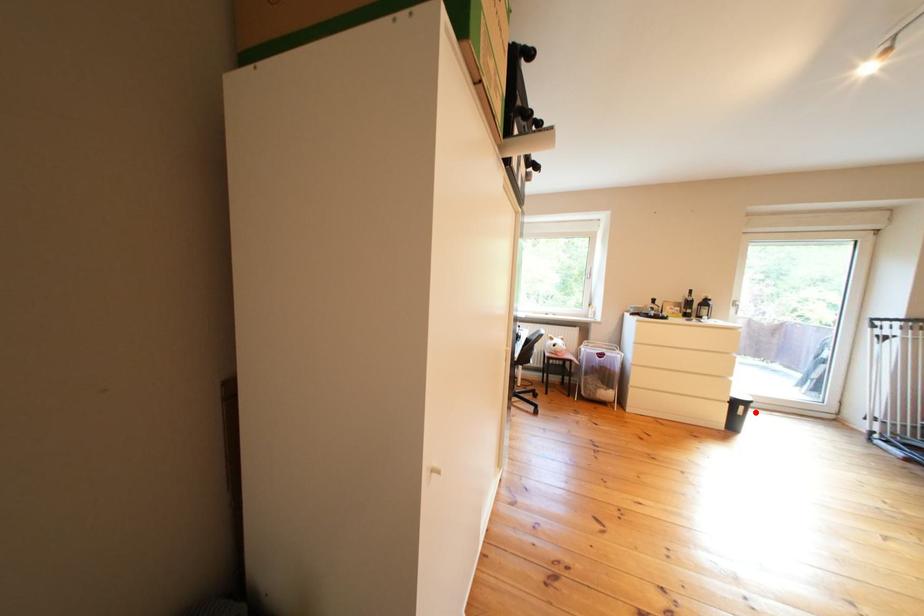
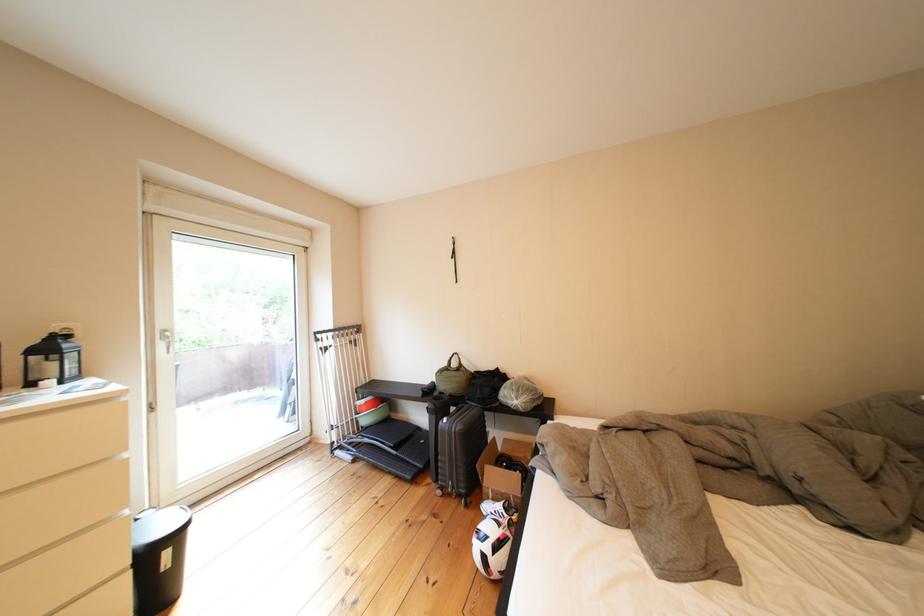
Question: I am providing you with two images of the same scene from different viewpoints. In image1, a red point is highlighted. Considering the same 3D point in image2, which of the following is correct?

Choices:
 (A) It is closer
 (B) It is farther

Answer: (A)